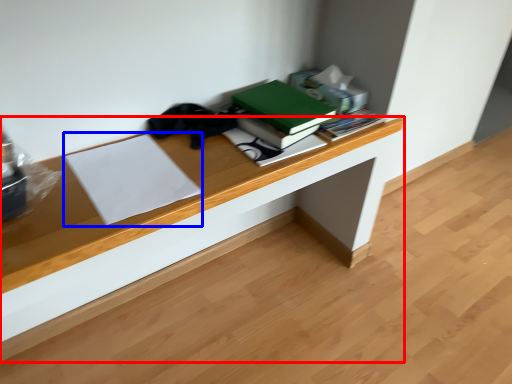
Question: Which object is further to the camera taking this photo, desk (highlighted by a red box) or paperback book (highlighted by a blue box)?

Choices:
 (A) desk
 (B) paperback book

Answer: (A)